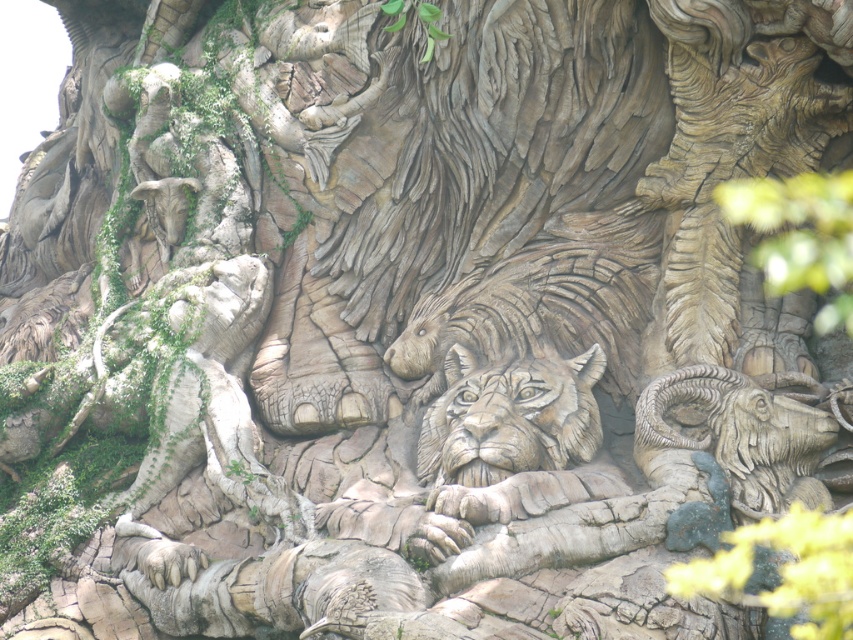
Consider the image. You are an art conservator examining the stone carving. You need to clean the carved stone lion at center and the carved stone ram at center. Which animal carving is located higher up in the stone carving?

The carved stone lion at center is positioned over the carved stone ram at center, so the lion is higher up.

Looking at the stone carving, there is a carved stone lion at center and a carved stone ram at center. Which animal figure is taller?

The carved stone lion at center is much taller than the carved stone ram at center.

You are an art restorer examining the stone carving. You need to apply a protective coating to both the wooden lion face at center and the wooden carving of bird at upper left. Given that the bird carving requires less coating material due to its smaller size, which object should you start with to ensure you have enough material left for the larger one?

The wooden lion face at center is larger than the wooden carving of bird at upper left, so you should start by applying the protective coating to the wooden carving of bird at upper left first to conserve material for the larger lion carving.